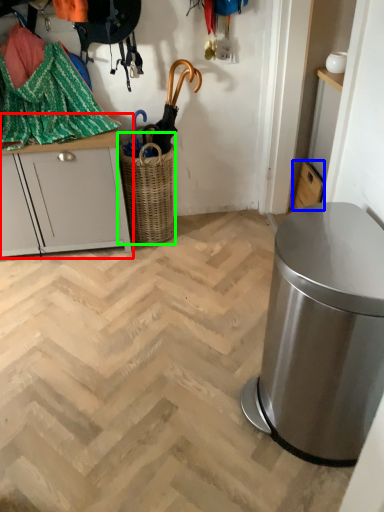
Question: Which object is the closest to the cabinetry (highlighted by a red box)? Choose among these: cabinetry (highlighted by a blue box) or basket (highlighted by a green box).

Choices:
 (A) cabinetry
 (B) basket

Answer: (B)